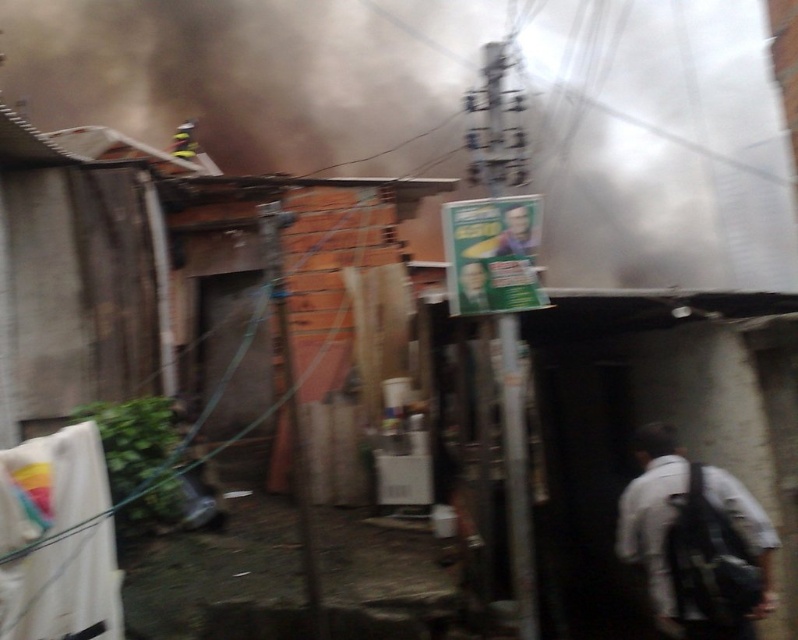
Question: Which point is farther from the camera taking this photo?

Choices:
 (A) (579, 157)
 (B) (745, 500)

Answer: (A)

Question: Is white fabric shirt at right to the right of white fabric at left from the viewer's perspective?

Choices:
 (A) no
 (B) yes

Answer: (B)

Question: Which point appears farthest from the camera in this image?

Choices:
 (A) (764, 541)
 (B) (243, 170)
 (C) (30, 445)

Answer: (B)

Question: Can you confirm if black smoke at upper center is positioned to the left of white fabric at left?

Choices:
 (A) no
 (B) yes

Answer: (A)

Question: Does black smoke at upper center have a lesser width compared to white fabric at left?

Choices:
 (A) yes
 (B) no

Answer: (B)

Question: Which point appears closest to the camera in this image?

Choices:
 (A) (401, 125)
 (B) (737, 508)
 (C) (74, 618)

Answer: (B)